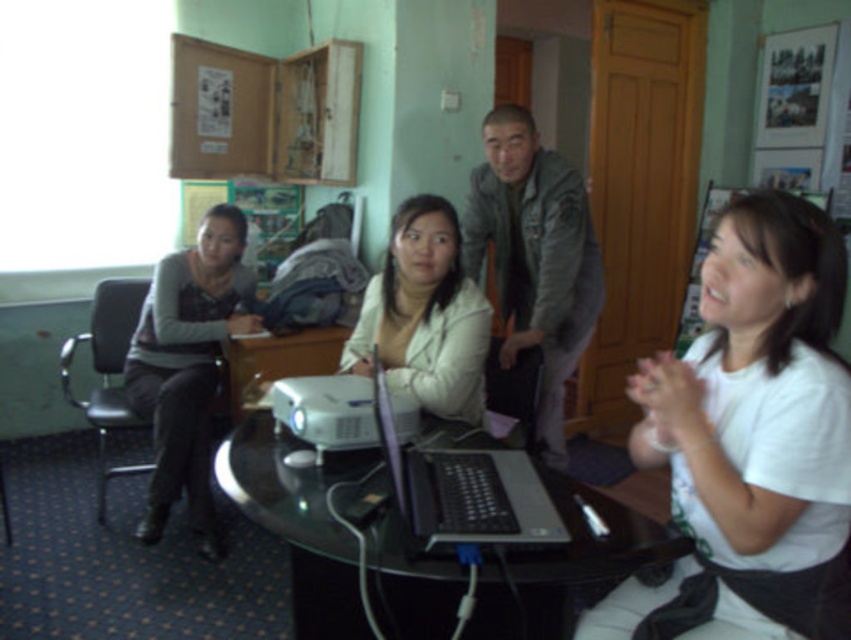
Is white matte shirt at lower right smaller than gray fabric jacket at upper center?

Yes.

Between point (698, 349) and point (547, 288), which one is positioned behind?

Positioned behind is point (547, 288).

Is point (724, 340) positioned after point (569, 316)?

No, (724, 340) is closer to viewer.

Find the location of a particular element. This screenshot has height=640, width=851. white matte shirt at lower right is located at coordinates (750, 440).

From the picture: Does black glass table at center appear under matte gray sweater at left?

Yes.

Who is more distant from viewer, (672, 540) or (204, 442)?

Positioned behind is point (204, 442).

Describe the element at coordinates (300, 522) in the screenshot. This screenshot has height=640, width=851. I see `black glass table at center` at that location.

At what (x,y) coordinates should I click in order to perform the action: click on black glass table at center. Please return your answer as a coordinate pair (x, y). Looking at the image, I should click on (300, 522).

Which is in front, point (197, 416) or point (391, 401)?

Point (391, 401) is more forward.

Is matte gray sweater at left to the left of silver/black plastic laptop at center from the viewer's perspective?

Yes, matte gray sweater at left is to the left of silver/black plastic laptop at center.

Does point (221, 317) lie in front of point (507, 477)?

That is False.

The image size is (851, 640). I want to click on matte gray sweater at left, so pos(187,365).